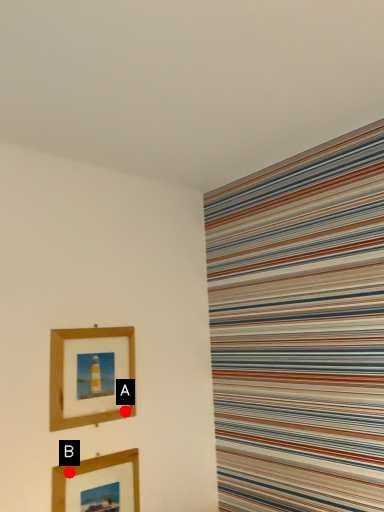
Question: Two points are circled on the image, labeled by A and B beside each circle. Which point appears farthest from the camera in this image?

Choices:
 (A) A is further
 (B) B is further

Answer: (A)